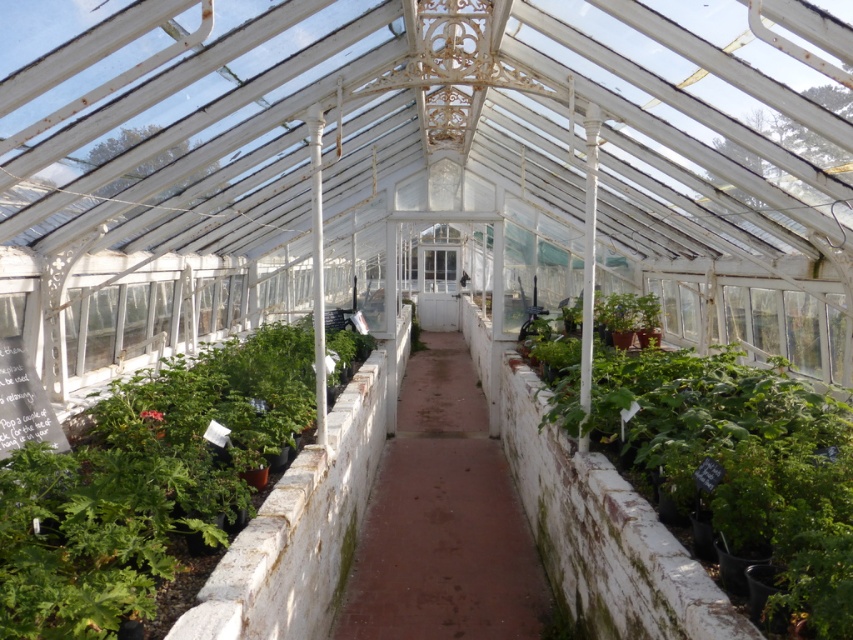
You are standing at the entrance of the greenhouse and want to reach the point marked as point (102, 467). There is an obstacle at point (805, 403) blocking your path. Can you walk directly to your destination without going around the obstacle?

Point (102, 467) is in front of point (805, 403), so you can walk directly to your destination without going around the obstacle because the destination is closer to you than the obstacle.

You are a gardener walking along the central walkway in the greenhouse. You want to water both the green leafy plant at left and the green leafy plant at right. Which plant should you water first if you want to water the one closer to you first?

You should water the green leafy plant at left first because it is in front of the green leafy plant at right, making it closer to you.